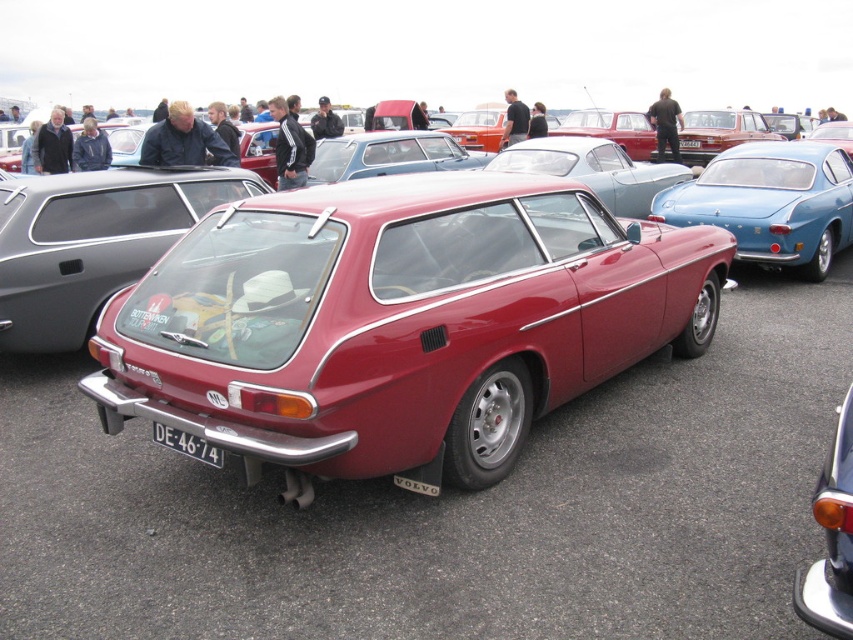
You are a photographer trying to capture a wide shot of the metallic silver sedan at center and the glossy metallic car at center at the car event. Given that your camera can only capture objects within a 3.5 meter width, will both cars fit in the frame?

The metallic silver sedan at center is wider than the glossy metallic car at center. Since the total width of both cars combined would exceed 3.5 meters, they cannot both fit within the camera frame.

You are a photographer standing at the edge of the car event venue. You want to take a photo of the metallic blue car at center and the white plastic license plate at lower center in the same frame. Given that your camera has a maximum focus range of 7 meters, will both objects be in focus?

The metallic blue car at center is 7.37 meters away from the white plastic license plate at lower center. Since the camera can focus up to 7 meters, the distance between them exceeds the maximum focus range. Therefore, both objects cannot be in focus simultaneously.

Looking at the classic car event, there is a metallic silver sedan at center and a glossy metallic car at center. Which one is positioned to the left?

The metallic silver sedan at center is positioned to the left of the glossy metallic car at center.